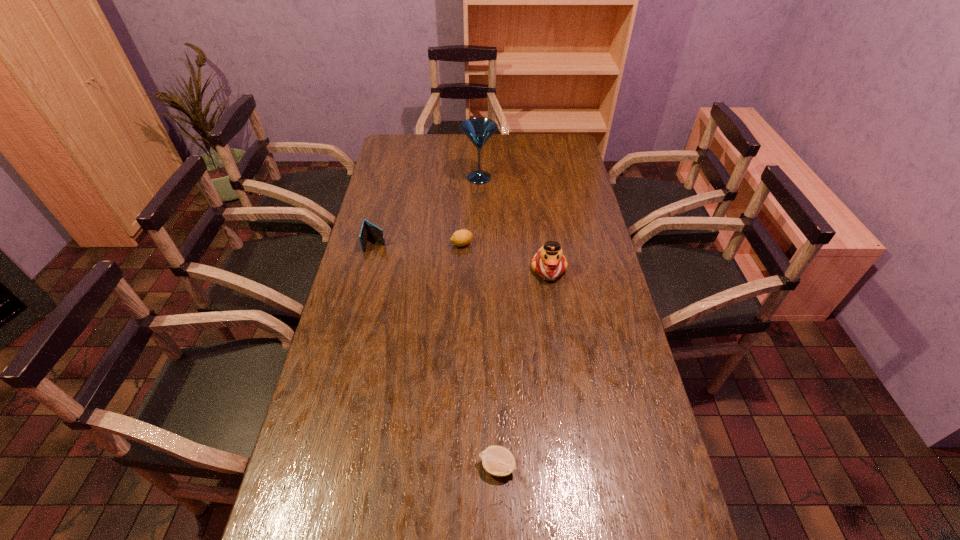
Locate an element on the screen. The image size is (960, 540). unoccupied position between the right lemon and the martini is located at coordinates (489, 322).

Find the location of a particular element. empty space that is in between the rightmost object and the third tallest object is located at coordinates (462, 256).

The height and width of the screenshot is (540, 960). I want to click on object that is the third closest to the right lemon, so click(x=368, y=229).

Image resolution: width=960 pixels, height=540 pixels. Identify the location of the closest object to the third tallest object. coord(462,237).

The image size is (960, 540). I want to click on free space in the image that satisfies the following two spatial constraints: 1. on the exterior surface of the wallet; 2. on the right side of the shortest object, so click(321, 466).

You are a GUI agent. You are given a task and a screenshot of the screen. Output one action in this format:
    pyautogui.click(x=<x>, y=<y>)
    Task: Click on the free location that satisfies the following two spatial constraints: 1. on the front side of the nearest object; 2. on the right side of the martini
    
    Given the screenshot: What is the action you would take?
    pyautogui.click(x=478, y=466)

This screenshot has width=960, height=540. I want to click on free location that satisfies the following two spatial constraints: 1. at the stem end of the shorter lemon; 2. on the left side of the farther lemon, so click(452, 466).

Image resolution: width=960 pixels, height=540 pixels. Identify the location of free location that satisfies the following two spatial constraints: 1. on the exterior surface of the nearer lemon; 2. on the right side of the wallet. (321, 466).

Where is `free space that satisfies the following two spatial constraints: 1. at the stem end of the farther lemon; 2. on the back side of the nearer lemon`? This screenshot has width=960, height=540. free space that satisfies the following two spatial constraints: 1. at the stem end of the farther lemon; 2. on the back side of the nearer lemon is located at coordinates (452, 466).